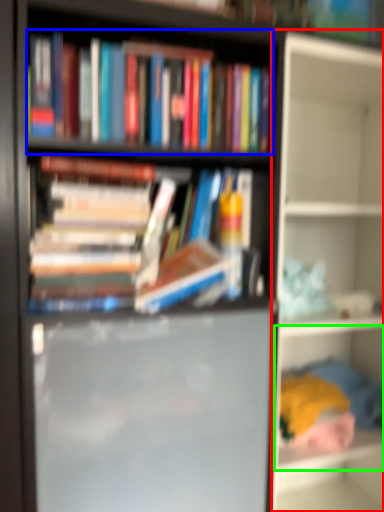
Question: Which object is the closest to the shelf (highlighted by a red box)? Choose among these: book (highlighted by a blue box) or shelf (highlighted by a green box).

Choices:
 (A) book
 (B) shelf

Answer: (B)